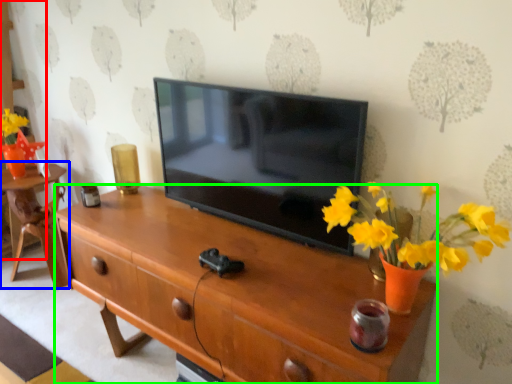
Question: Based on their relative distances, which object is nearer to cabinetry (highlighted by a red box)? Choose from table (highlighted by a blue box) and desk (highlighted by a green box).

Choices:
 (A) table
 (B) desk

Answer: (A)